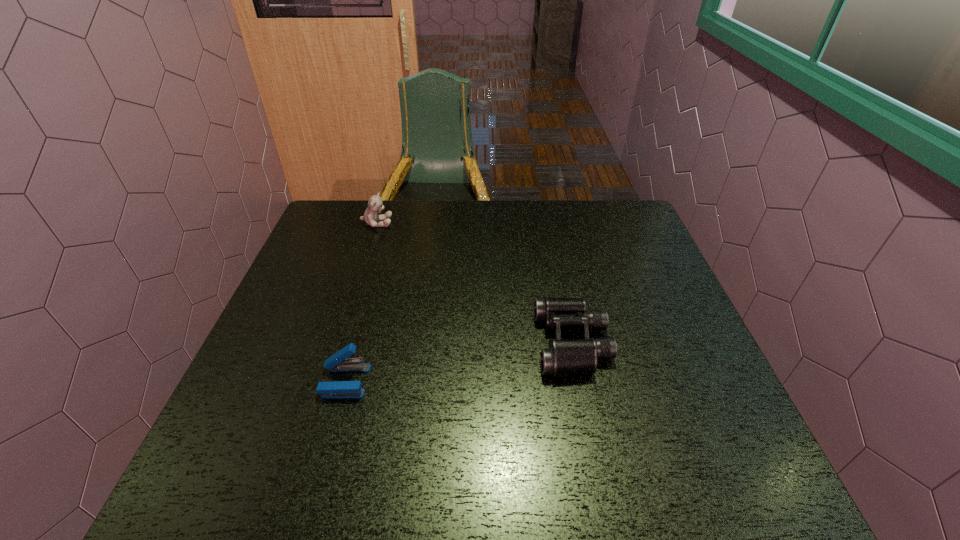
Identify the location of object located at the far left corner. The image size is (960, 540). (375, 204).

In the image, there is a desktop. Where is `vacant space at the far edge`? The width and height of the screenshot is (960, 540). vacant space at the far edge is located at coordinates (481, 216).

Identify the location of blank area at the near edge. (439, 488).

Locate an element on the screen. Image resolution: width=960 pixels, height=540 pixels. vacant space at the left edge of the desktop is located at coordinates (352, 251).

The image size is (960, 540). Identify the location of free space at the right edge of the desktop. (671, 328).

At what (x,y) coordinates should I click in order to perform the action: click on free space at the near left corner of the desktop. Please return your answer as a coordinate pair (x, y). Image resolution: width=960 pixels, height=540 pixels. Looking at the image, I should click on (261, 478).

Where is `blank region between the farthest object and the stapler`? blank region between the farthest object and the stapler is located at coordinates (361, 302).

Locate an element on the screen. free point between the farthest object and the binoculars is located at coordinates (475, 283).

What are the coordinates of `vacant space that is in between the farthest object and the rightmost object` in the screenshot? It's located at (475, 283).

Locate an element on the screen. This screenshot has width=960, height=540. blank region between the binoculars and the stapler is located at coordinates (459, 362).